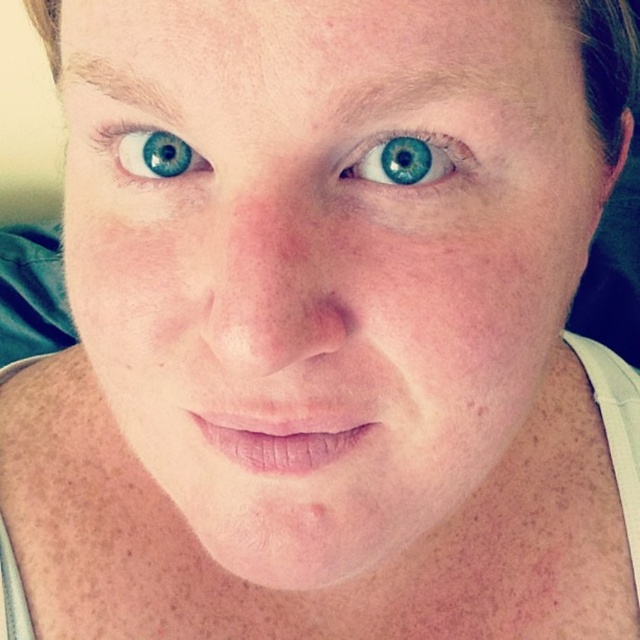
Question: Which point is farther to the camera?

Choices:
 (A) (140, 140)
 (B) (381, 147)

Answer: (A)

Question: Does blue glossy eye at upper center come behind blue glossy eye at upper left?

Choices:
 (A) yes
 (B) no

Answer: (B)

Question: Can you confirm if blue glossy eye at upper center is positioned to the left of blue glossy eye at upper left?

Choices:
 (A) yes
 (B) no

Answer: (B)

Question: Which point is farther from the camera taking this photo?

Choices:
 (A) [x=138, y=141]
 (B) [x=448, y=161]

Answer: (A)

Question: Among these objects, which one is nearest to the camera?

Choices:
 (A) blue glossy eye at upper center
 (B) blue glossy eye at upper left

Answer: (A)

Question: Does blue glossy eye at upper center have a greater width compared to blue glossy eye at upper left?

Choices:
 (A) yes
 (B) no

Answer: (A)